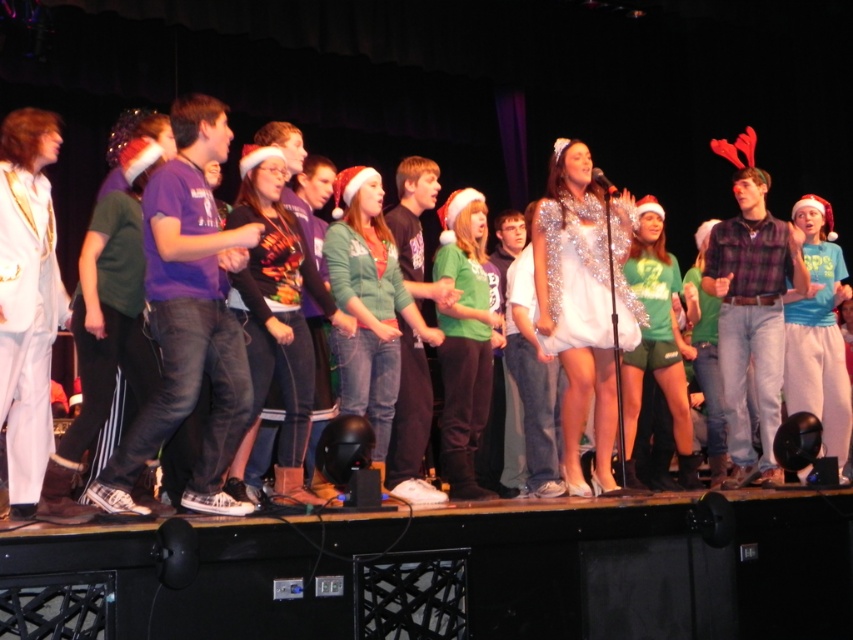
Question: In this image, where is shiny silver dress at center located relative to white leather boots at left?

Choices:
 (A) below
 (B) above

Answer: (B)

Question: Which point is farther to the camera?

Choices:
 (A) (32, 241)
 (B) (782, 214)

Answer: (B)

Question: In this image, where is shiny silver dress at center located relative to white leather boots at left?

Choices:
 (A) left
 (B) right

Answer: (B)

Question: Can you confirm if shiny silver dress at center is wider than white leather boots at left?

Choices:
 (A) no
 (B) yes

Answer: (B)

Question: Among these points, which one is farthest from the camera?

Choices:
 (A) (80, 106)
 (B) (10, 392)

Answer: (A)